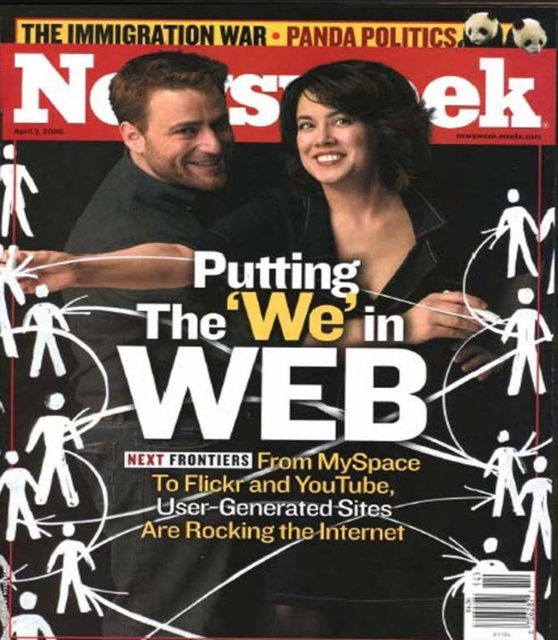
Looking at this image, you are designing a digital replica of this Newsweek cover and need to ensure the spacing between the black glossy hair at upper center and the smooth black shirt at center matches the original. What is the exact distance you should maintain between them?

The exact distance between the black glossy hair at upper center and the smooth black shirt at center should be 26.20 centimeters to match the original cover.

From the picture: You are a graphic designer reviewing the Newsweek cover. You need to determine the spatial relationship between the black glossy hair at upper center and the smooth black shirt at center. Which object is positioned higher on the cover?

The black glossy hair at upper center is located above the smooth black shirt at center, so it is positioned higher on the cover.

You are a graphic designer reviewing the Newsweek cover. You notice the black glossy hair at upper center and the smooth black shirt at center. Which object is layered in front of the other?

The black glossy hair at upper center is layered in front of the smooth black shirt at center because the shirt is described as being behind the hair.